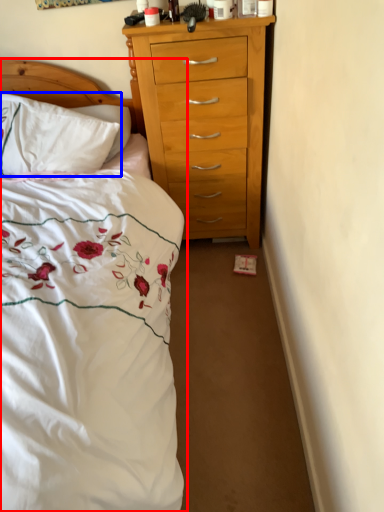
Question: Among these objects, which one is farthest to the camera, bed (highlighted by a red box) or pillow (highlighted by a blue box)?

Choices:
 (A) bed
 (B) pillow

Answer: (B)